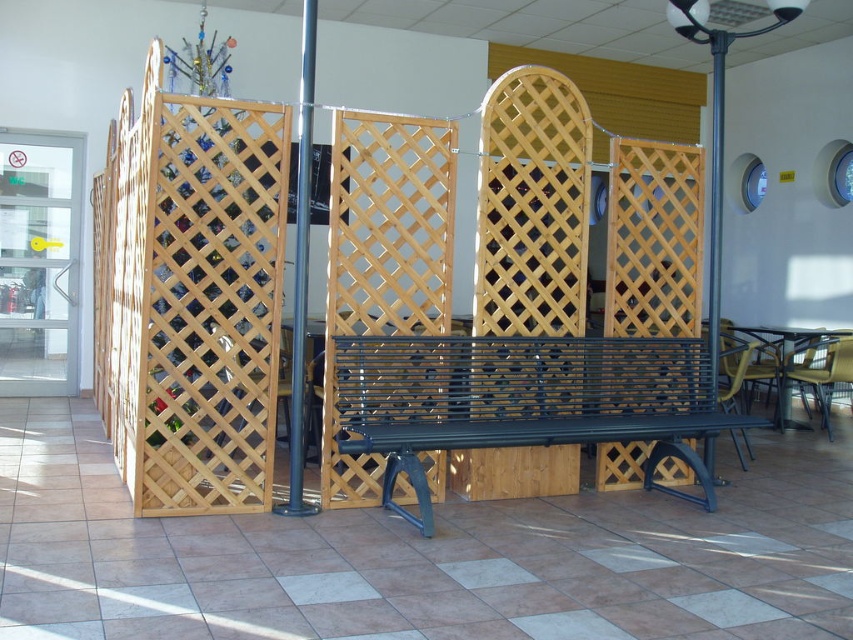
You are a maintenance worker checking the layout of the indoor space. You need to place a new plant pot between the black metal bench at center and the metallic pole at right. Is there enough space between them for the plant pot?

The black metal bench at center is positioned under the metallic pole at right, which means they are close to each other. However, since the bench is under the pole, there might be vertical space but not horizontal space between them. Therefore, placing a plant pot between them horizontally may not be feasible.

You are a maintenance worker needing to move a 1.5 meter long tool cart between the black metal bench at center and the metallic pole at center. Can you fit the cart through the space between them?

The black metal bench at center and the metallic pole at center are 1.30 meters apart. Since the tool cart is 1.5 meters long, it cannot fit through the space between them as the distance is shorter than the cart.